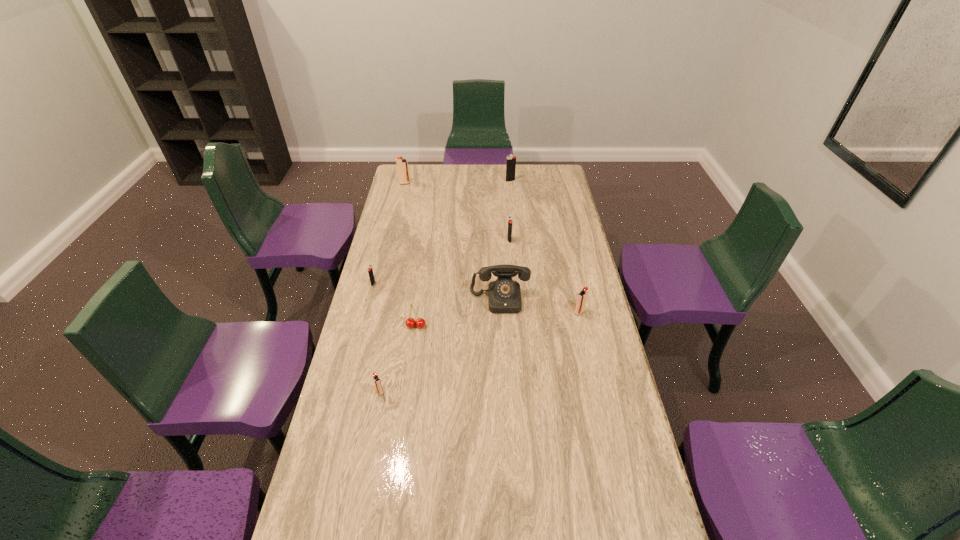
Locate an element on the screen. This screenshot has width=960, height=540. the nearest red igniter is located at coordinates (378, 386).

Locate an element on the screen. The image size is (960, 540). the smallest red igniter is located at coordinates (378, 386).

Where is `the nearest black igniter`? The image size is (960, 540). the nearest black igniter is located at coordinates (370, 271).

Find the location of `the leftmost black igniter`. the leftmost black igniter is located at coordinates (370, 271).

Locate an element on the screen. The image size is (960, 540). blank space located on the back of the farthest red igniter is located at coordinates (407, 174).

At what (x,y) coordinates should I click in order to perform the action: click on free space located 0.050m on the front of the biggest black igniter. Please return your answer as a coordinate pair (x, y). Looking at the image, I should click on (511, 187).

In order to click on vacant space located 0.060m on the dial of the telephone in this screenshot , I will do `click(501, 326)`.

You are a GUI agent. You are given a task and a screenshot of the screen. Output one action in this format:
    pyautogui.click(x=<x>, y=<y>)
    Task: Click on the vacant region located on the front of the sixth nearest object
    This screenshot has height=540, width=960.
    Given the screenshot: What is the action you would take?
    pyautogui.click(x=514, y=295)

At what (x,y) coordinates should I click in order to perform the action: click on vacant space situated on the back of the second farthest red igniter. Please return your answer as a coordinate pair (x, y). The width and height of the screenshot is (960, 540). Looking at the image, I should click on (573, 286).

Image resolution: width=960 pixels, height=540 pixels. Find the location of `vacant region located 0.370m with the stems of the fifth object from right to left pointing upwards`. vacant region located 0.370m with the stems of the fifth object from right to left pointing upwards is located at coordinates (402, 426).